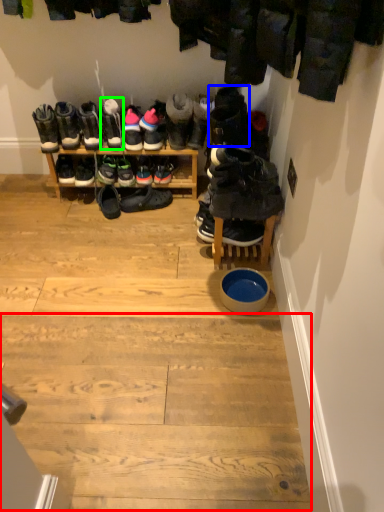
Question: Which object is the farthest from stair (highlighted by a red box)? Choose among these: footwear (highlighted by a blue box) or footwear (highlighted by a green box).

Choices:
 (A) footwear
 (B) footwear

Answer: (B)